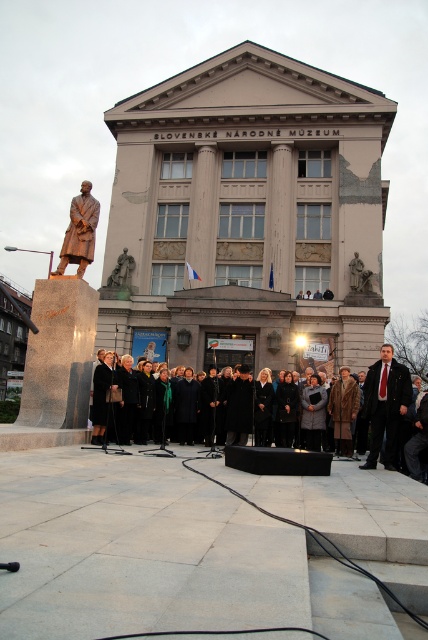
Does point (77, 273) come closer to viewer compared to point (124, 275)?

That is True.

Which is behind, point (85, 268) or point (124, 259)?

The point (124, 259) is behind.

Image resolution: width=428 pixels, height=640 pixels. What are the coordinates of `bronze statue at left` in the screenshot? It's located at (80, 230).

Find the location of a particular element. The height and width of the screenshot is (640, 428). dark suit at center is located at coordinates (385, 404).

Between dark suit at center and bronze statue at center, which one has more height?

dark suit at center is taller.

Which is behind, point (410, 378) or point (125, 260)?

The point (125, 260) is more distant.

The image size is (428, 640). Identify the location of dark suit at center. (385, 404).

Between dark suit at center and bronze statue at left, which one appears on the left side from the viewer's perspective?

bronze statue at left is more to the left.

Can you confirm if dark suit at center is positioned to the right of bronze statue at left?

Indeed, dark suit at center is positioned on the right side of bronze statue at left.

Does point (394, 397) come closer to viewer compared to point (89, 237)?

Yes, it is in front of point (89, 237).

Find the location of a particular element. dark suit at center is located at coordinates (385, 404).